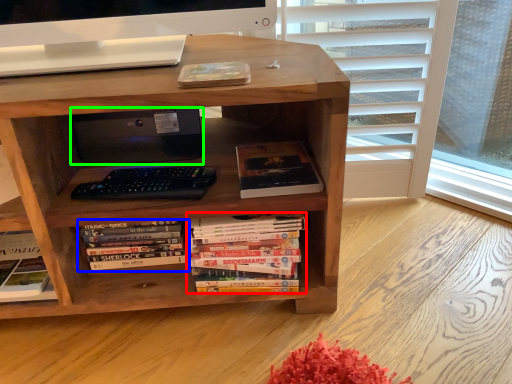
Question: Based on their relative distances, which object is nearer to book (highlighted by a red box)? Choose from book (highlighted by a blue box) and computer (highlighted by a green box).

Choices:
 (A) book
 (B) computer

Answer: (A)